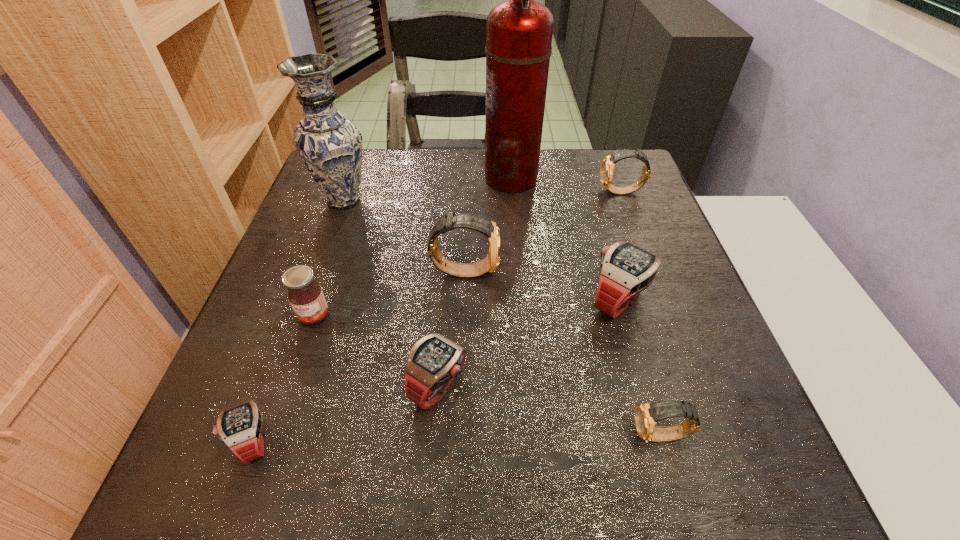
Where is `jam`? The height and width of the screenshot is (540, 960). jam is located at coordinates (305, 295).

The height and width of the screenshot is (540, 960). Find the location of `the second biggest red watch`. the second biggest red watch is located at coordinates (434, 361).

Identify the location of the nearest gold watch. The width and height of the screenshot is (960, 540). (647, 415).

The width and height of the screenshot is (960, 540). I want to click on the leftmost red watch, so click(x=240, y=427).

Where is `the leftmost watch`? The image size is (960, 540). the leftmost watch is located at coordinates (240, 427).

At what (x,y) coordinates should I click in order to perform the action: click on vacant space located on the side of the red fire extinguisher with the handle and hose. Please return your answer as a coordinate pair (x, y). Looking at the image, I should click on (340, 178).

The height and width of the screenshot is (540, 960). Find the location of `free space located 0.110m on the side of the red fire extinguisher with the handle and hose`. free space located 0.110m on the side of the red fire extinguisher with the handle and hose is located at coordinates (444, 178).

Identify the location of blank space located 0.390m on the side of the red fire extinguisher with the handle and hose. This screenshot has width=960, height=540. (344, 178).

The image size is (960, 540). I want to click on free location located 0.060m on the right of the vase, so click(x=396, y=200).

Where is `free space located 0.060m on the face of the seventh shortest object`? free space located 0.060m on the face of the seventh shortest object is located at coordinates point(525,271).